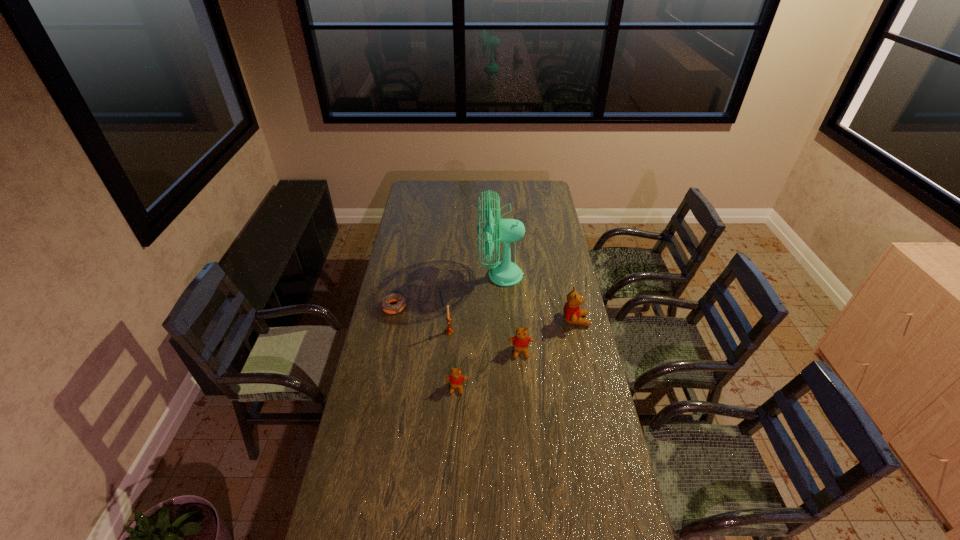
Locate an element on the screen. The image size is (960, 540). vacant area situated 0.080m on the front-facing side of the fifth tallest object is located at coordinates (455, 414).

Identify the location of blank space located 0.200m on the front-facing side of the second nearest object. Image resolution: width=960 pixels, height=540 pixels. (525, 403).

Image resolution: width=960 pixels, height=540 pixels. Identify the location of free location located on the back of the shortest object. (406, 248).

Find the location of a particular element. vacant space located 0.310m in front of the fan to blow air is located at coordinates (414, 275).

This screenshot has height=540, width=960. Identify the location of vacant space situated in front of the fan to blow air. (447, 275).

In order to click on free spot located in front of the fan to blow air in this screenshot , I will do `click(464, 275)`.

Identify the location of blank area located on the back of the candle_holder. Image resolution: width=960 pixels, height=540 pixels. (452, 287).

I want to click on object that is at the left edge, so click(395, 297).

Identify the location of object positioned at the right edge. The height and width of the screenshot is (540, 960). (572, 313).

The image size is (960, 540). I want to click on vacant space at the far edge of the desktop, so click(x=483, y=197).